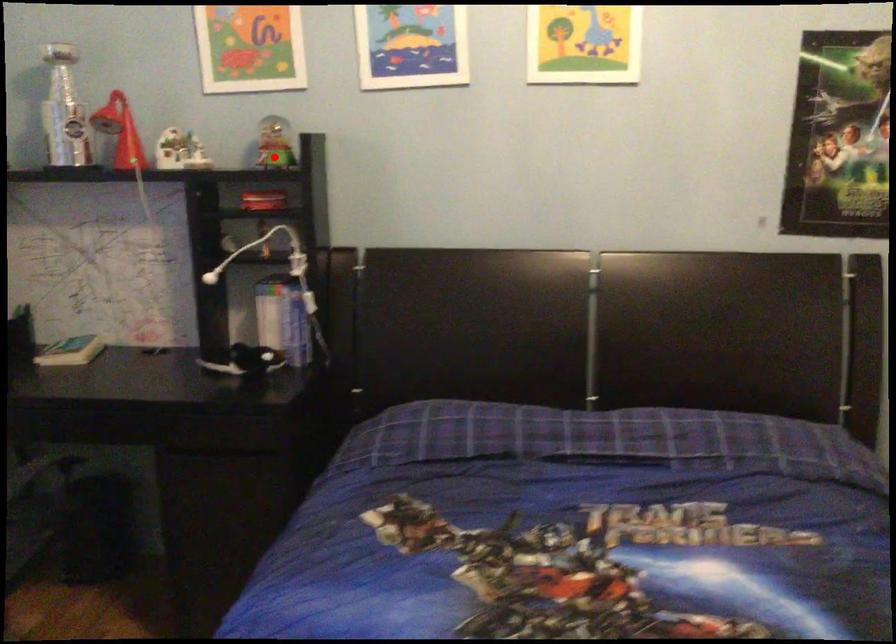
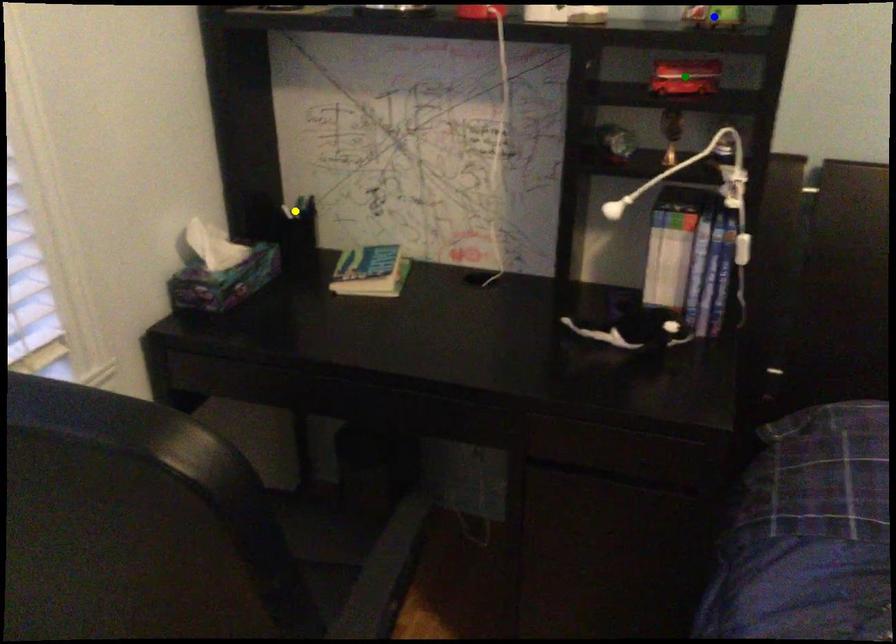
Question: I am providing you with two images of the same scene from different viewpoints. A red point is marked on the first image. You are given multiple points on the second image. Which mark in image 2 goes with the point in image 1?

Choices:
 (A) blue point
 (B) green point
 (C) yellow point

Answer: (A)